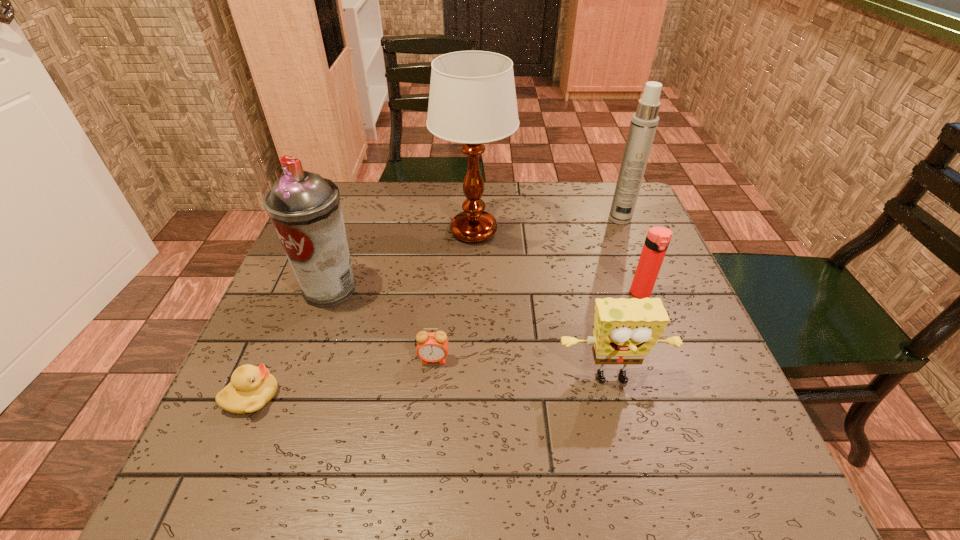
What are the coordinates of `thermos bottle that is at the right edge` in the screenshot? It's located at (657, 240).

Identify the location of object situated at the far right corner. The image size is (960, 540). (644, 122).

Locate an element on the screen. This screenshot has height=540, width=960. free location at the far edge is located at coordinates (426, 201).

The width and height of the screenshot is (960, 540). In the image, there is a desktop. Find the location of `free space at the left edge`. free space at the left edge is located at coordinates (282, 294).

Locate an element on the screen. The width and height of the screenshot is (960, 540). free space at the right edge of the desktop is located at coordinates (624, 281).

Identify the location of free space at the far left corner of the desktop. The image size is (960, 540). (362, 185).

You are a GUI agent. You are given a task and a screenshot of the screen. Output one action in this format:
    pyautogui.click(x=<x>, y=<y>)
    Task: Click on the vacant space at the near left corner of the desktop
    This screenshot has width=960, height=540.
    Given the screenshot: What is the action you would take?
    pyautogui.click(x=282, y=441)

I want to click on vacant space at the near right corner, so click(x=748, y=474).

In order to click on free space that is in between the shortest object and the alarm clock in this screenshot , I will do `click(343, 378)`.

Locate an element on the screen. The height and width of the screenshot is (540, 960). vacant space that's between the duckling and the table lamp is located at coordinates (363, 314).